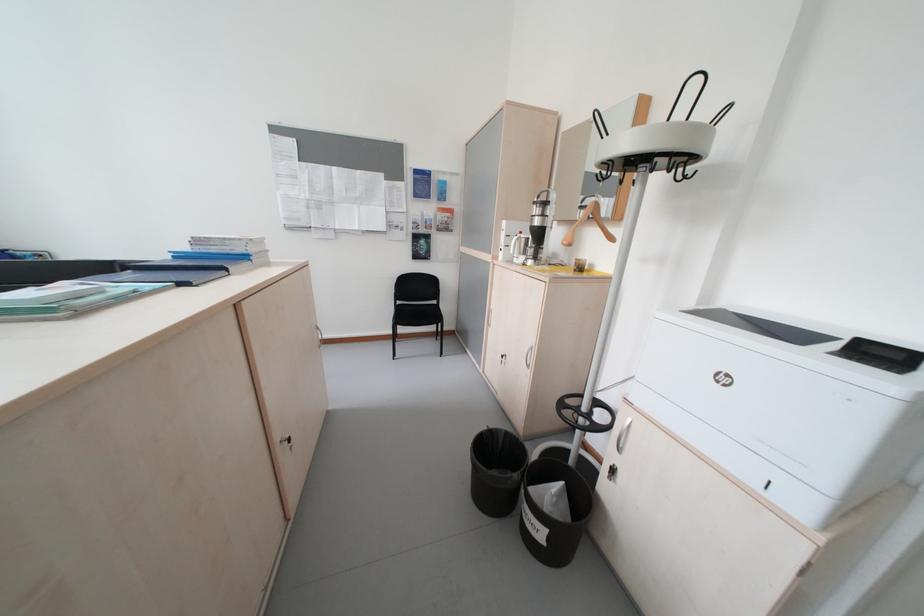
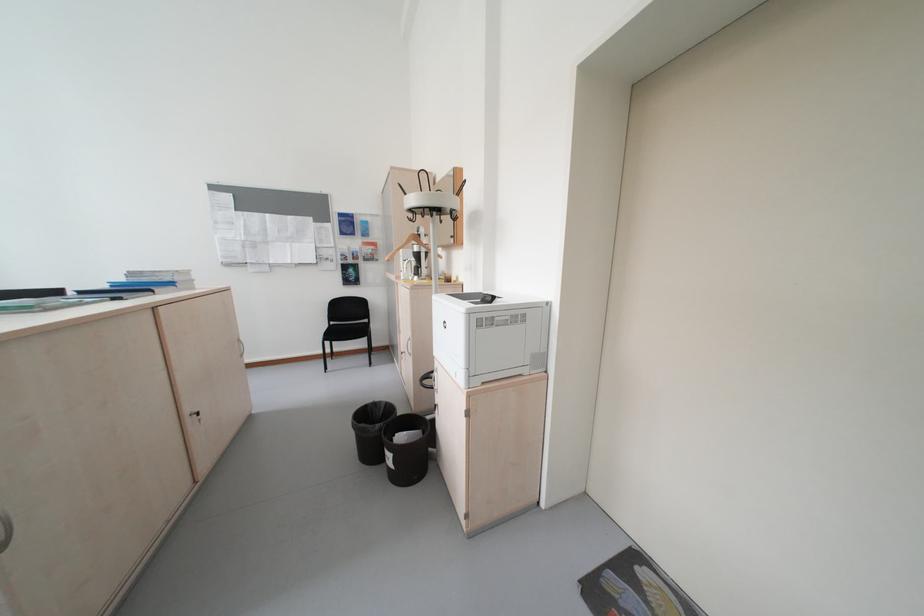
Where in the second image is the point corresponding to pixel 468 227 from the first image?

(393, 257)